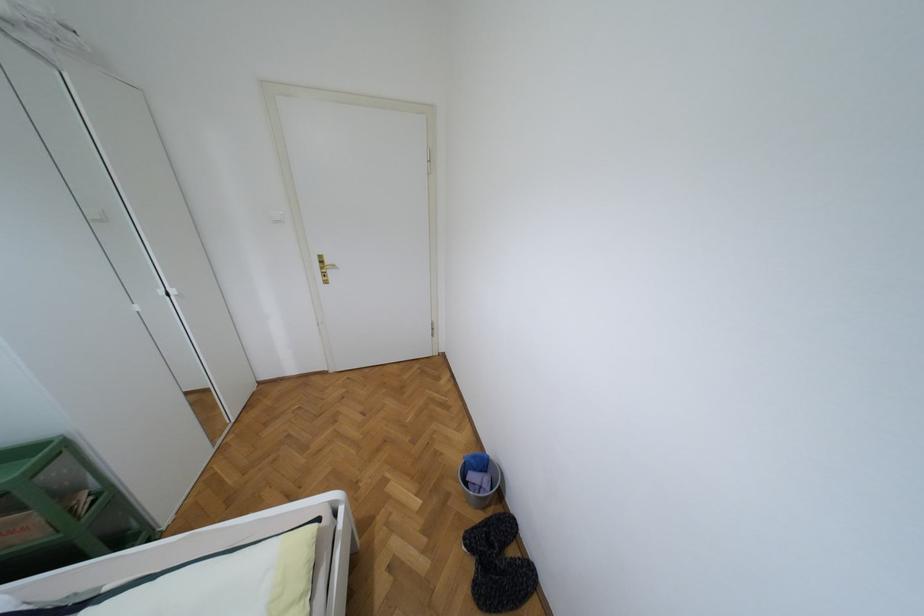
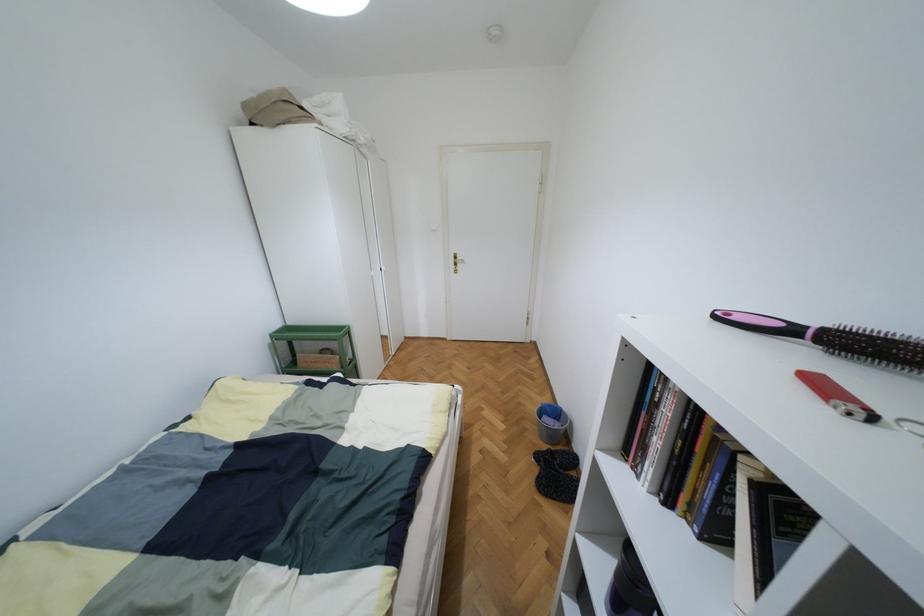
The point at (473, 456) is marked in the first image. Where is the corresponding point in the second image?

(549, 406)